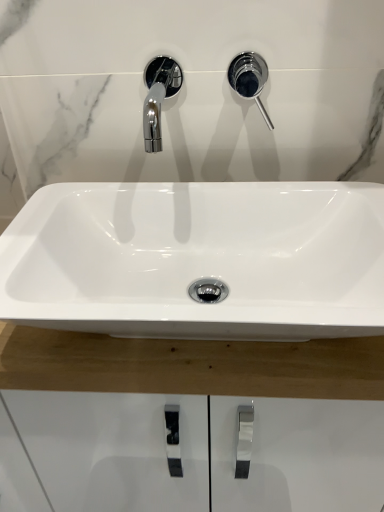
What do you see at coordinates (249, 79) in the screenshot? I see `polished chrome faucet at upper right` at bounding box center [249, 79].

Where is `polished chrome faucet at upper right`? polished chrome faucet at upper right is located at coordinates (249, 79).

This screenshot has height=512, width=384. What are the coordinates of `white glossy sink at center` in the screenshot? It's located at (199, 208).

This screenshot has width=384, height=512. Describe the element at coordinates (199, 208) in the screenshot. I see `white glossy sink at center` at that location.

Locate an element on the screen. The image size is (384, 512). polished chrome faucet at upper right is located at coordinates (249, 79).

Does polished chrome faucet at upper right appear on the right side of white glossy sink at center?

Yes.

Based on the photo, which is behind, polished chrome faucet at upper right or white glossy sink at center?

Positioned behind is polished chrome faucet at upper right.

Considering the positions of points (238, 65) and (382, 323), is point (238, 65) closer to camera compared to point (382, 323)?

No.

From the image's perspective, is polished chrome faucet at upper right above or below white glossy sink at center?

Clearly, from the image's perspective, polished chrome faucet at upper right is above white glossy sink at center.

From a real-world perspective, is polished chrome faucet at upper right above or below white glossy sink at center?

In terms of real-world spatial position, polished chrome faucet at upper right is above white glossy sink at center.

Which object is wider, polished chrome faucet at upper right or white glossy sink at center?

With larger width is white glossy sink at center.

Is polished chrome faucet at upper right taller or shorter than white glossy sink at center?

Clearly, polished chrome faucet at upper right is taller compared to white glossy sink at center.

Which of these two, polished chrome faucet at upper right or white glossy sink at center, is smaller?

With smaller size is polished chrome faucet at upper right.

Could white glossy sink at center be considered to be inside polished chrome faucet at upper right?

No, white glossy sink at center is not a part of polished chrome faucet at upper right.

Is polished chrome faucet at upper right next to white glossy sink at center and touching it?

No, polished chrome faucet at upper right is not next to white glossy sink at center.

Could you tell me if polished chrome faucet at upper right is turned towards white glossy sink at center?

No, polished chrome faucet at upper right does not turn towards white glossy sink at center.

What's the angular difference between polished chrome faucet at upper right and white glossy sink at center's facing directions?

They differ by 0.000164 degrees in their facing directions.

The width and height of the screenshot is (384, 512). I want to click on plumbing fixture lying behind the white glossy sink at center, so click(x=249, y=79).

Considering the relative positions of white glossy sink at center and polished chrome faucet at upper right in the image provided, is white glossy sink at center to the left of polished chrome faucet at upper right from the viewer's perspective?

Correct, you'll find white glossy sink at center to the left of polished chrome faucet at upper right.

Which object is further away from the camera taking this photo, white glossy sink at center or polished chrome faucet at upper right?

polished chrome faucet at upper right is behind.

Does point (92, 127) appear closer or farther from the camera than point (248, 75)?

Point (92, 127).

In the scene shown: From the image's perspective, which object appears higher, white glossy sink at center or polished chrome faucet at upper right?

polished chrome faucet at upper right.

From a real-world perspective, is white glossy sink at center positioned above or below polished chrome faucet at upper right?

white glossy sink at center is situated lower than polished chrome faucet at upper right in the real world.

Can you confirm if white glossy sink at center is thinner than polished chrome faucet at upper right?

In fact, white glossy sink at center might be wider than polished chrome faucet at upper right.

Is white glossy sink at center taller or shorter than polished chrome faucet at upper right?

Considering their sizes, white glossy sink at center has less height than polished chrome faucet at upper right.

Between white glossy sink at center and polished chrome faucet at upper right, which one has smaller size?

Smaller between the two is polished chrome faucet at upper right.

Is polished chrome faucet at upper right inside white glossy sink at center?

Definitely not — polished chrome faucet at upper right is not inside white glossy sink at center.

Can you see white glossy sink at center touching polished chrome faucet at upper right?

No, white glossy sink at center is not next to polished chrome faucet at upper right.

Is white glossy sink at center turned away from polished chrome faucet at upper right?

No, white glossy sink at center is not facing away from polished chrome faucet at upper right.

I want to click on plumbing fixture that is behind the white glossy sink at center, so click(x=249, y=79).

This screenshot has height=512, width=384. Identify the location of plumbing fixture located above the white glossy sink at center (from the image's perspective). (249, 79).

Locate an element on the screen. Image resolution: width=384 pixels, height=512 pixels. plumbing fixture lying behind the white glossy sink at center is located at coordinates (249, 79).